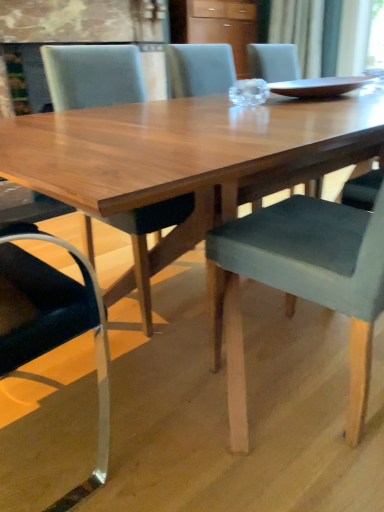
Describe the element at coordinates (319, 86) in the screenshot. Image resolution: width=384 pixels, height=512 pixels. I see `matte brown tray at center` at that location.

You are a GUI agent. You are given a task and a screenshot of the screen. Output one action in this format:
    pyautogui.click(x=<x>, y=<y>)
    Task: Click on the wooden cabinet at upper center
    This screenshot has height=512, width=384.
    Given the screenshot: What is the action you would take?
    pyautogui.click(x=224, y=26)

Considering the positions of objects wooden cabinet at upper center and matte gray chair at center, which is the 2th chair from right to left, in the image provided, who is behind, wooden cabinet at upper center or matte gray chair at center, which is the 2th chair from right to left,?

wooden cabinet at upper center is further away from the camera.

Is wooden cabinet at upper center inside the boundaries of matte gray chair at center, which is the 2th chair from right to left, or outside?

wooden cabinet at upper center is not enclosed by matte gray chair at center, which is the 2th chair from right to left.

Is wooden cabinet at upper center positioned far away from matte gray chair at center, which is the 2th chair from right to left?

Yes, wooden cabinet at upper center is far from matte gray chair at center, which is the 2th chair from right to left.

From the image's perspective, which is below, wooden cabinet at upper center or matte gray chair at center, which is the 2th chair from right to left?

matte gray chair at center, which is the 2th chair from right to left.

How different are the orientations of velvet grey chair at center, the first chair when ordered from right to left, and wooden cabinet at upper center in degrees?

The facing directions of velvet grey chair at center, the first chair when ordered from right to left, and wooden cabinet at upper center are 178 degrees apart.

Between velvet grey chair at center, positioned as the second chair in left-to-right order, and wooden cabinet at upper center, which one has smaller width?

wooden cabinet at upper center is thinner.

From the image's perspective, does velvet grey chair at center, the first chair when ordered from right to left, appear lower than wooden cabinet at upper center?

Yes.

Based on the photo, from a real-world perspective, between velvet grey chair at center, positioned as the second chair in left-to-right order, and wooden cabinet at upper center, who is vertically lower?

velvet grey chair at center, positioned as the second chair in left-to-right order.

Is matte gray chair at center, the first chair when ordered from left to right, positioned behind wooden cabinet at upper center?

That is False.

From a real-world perspective, which object rests below the other?

matte gray chair at center, which is the 2th chair from right to left, from a real-world perspective.

Is matte brown tray at center positioned with its back to wooden cabinet at upper center?

matte brown tray at center is not turned away from wooden cabinet at upper center.

Considering the sizes of objects matte brown tray at center and wooden cabinet at upper center in the image provided, who is shorter, matte brown tray at center or wooden cabinet at upper center?

matte brown tray at center.

Can you see matte brown tray at center touching wooden cabinet at upper center?

matte brown tray at center is not next to wooden cabinet at upper center, and they're not touching.

Measure the distance between matte brown tray at center and wooden cabinet at upper center.

matte brown tray at center is 1.80 meters from wooden cabinet at upper center.

Is wooden cabinet at upper center turned away from velvet grey chair at center, positioned as the second chair in left-to-right order?

No.

Do you think wooden cabinet at upper center is within velvet grey chair at center, the first chair when ordered from right to left, or outside of it?

wooden cabinet at upper center exists outside the volume of velvet grey chair at center, the first chair when ordered from right to left.

From the image's perspective, would you say wooden cabinet at upper center is positioned over velvet grey chair at center, the first chair when ordered from right to left?

Correct, wooden cabinet at upper center appears higher than velvet grey chair at center, the first chair when ordered from right to left, in the image.

Does wooden cabinet at upper center have a lesser width compared to velvet grey chair at center, positioned as the second chair in left-to-right order?

Indeed, wooden cabinet at upper center has a lesser width compared to velvet grey chair at center, positioned as the second chair in left-to-right order.

Could you tell me if velvet grey chair at center, the first chair when ordered from right to left, is turned towards matte brown tray at center?

No, velvet grey chair at center, the first chair when ordered from right to left, does not turn towards matte brown tray at center.

The width and height of the screenshot is (384, 512). Identify the location of tray lying on the right of velvet grey chair at center, positioned as the second chair in left-to-right order. (319, 86).

Is matte gray chair at center, which is the 2th chair from right to left, positioned with its back to matte brown tray at center?

No, matte gray chair at center, which is the 2th chair from right to left, is not facing the opposite direction of matte brown tray at center.

How many degrees apart are the facing directions of matte gray chair at center, the first chair when ordered from left to right, and matte brown tray at center?

179 degrees.

Is matte brown tray at center surrounded by matte gray chair at center, which is the 2th chair from right to left?

That's incorrect, matte brown tray at center is not inside matte gray chair at center, which is the 2th chair from right to left.

What are the coordinates of `cabinetry behind the matte gray chair at center, the first chair when ordered from left to right` in the screenshot? It's located at (224, 26).

I want to click on the 2nd chair in front of the wooden cabinet at upper center, so click(304, 283).

Consider the image. Based on their spatial positions, is matte gray chair at center, the first chair when ordered from left to right, or wooden cabinet at upper center further from velvet grey chair at center, the first chair when ordered from right to left?

wooden cabinet at upper center is further to velvet grey chair at center, the first chair when ordered from right to left.

Which object lies further to the anchor point velvet grey chair at center, positioned as the second chair in left-to-right order, matte gray chair at center, the first chair when ordered from left to right, or matte brown tray at center?

Among the two, matte gray chair at center, the first chair when ordered from left to right, is located further to velvet grey chair at center, positioned as the second chair in left-to-right order.

Based on their spatial positions, is matte gray chair at center, which is the 2th chair from right to left, or matte brown tray at center closer to wooden cabinet at upper center?

matte brown tray at center.

Considering their positions, is matte gray chair at center, the first chair when ordered from left to right, positioned further to matte brown tray at center than velvet grey chair at center, positioned as the second chair in left-to-right order?

matte gray chair at center, the first chair when ordered from left to right.

Estimate the real-world distances between objects in this image. Which object is further from matte brown tray at center, wooden cabinet at upper center or velvet grey chair at center, positioned as the second chair in left-to-right order?

wooden cabinet at upper center is positioned further to the anchor matte brown tray at center.

Which object lies further to the anchor point velvet grey chair at center, the first chair when ordered from right to left, wooden cabinet at upper center or matte gray chair at center, which is the 2th chair from right to left?

wooden cabinet at upper center lies further to velvet grey chair at center, the first chair when ordered from right to left, than the other object.

Looking at the image, which one is located further to matte brown tray at center, velvet grey chair at center, positioned as the second chair in left-to-right order, or wooden cabinet at upper center?

Among the two, wooden cabinet at upper center is located further to matte brown tray at center.

Considering their positions, is velvet grey chair at center, the first chair when ordered from right to left, positioned closer to wooden cabinet at upper center than matte brown tray at center?

matte brown tray at center lies closer to wooden cabinet at upper center than the other object.

You are a GUI agent. You are given a task and a screenshot of the screen. Output one action in this format:
    pyautogui.click(x=<x>, y=<y>)
    Task: Click on the chair located between velvet grey chair at center, positioned as the second chair in left-to-right order, and wooden cabinet at upper center in the depth direction
    Image resolution: width=384 pixels, height=512 pixels.
    Given the screenshot: What is the action you would take?
    pyautogui.click(x=92, y=75)

The width and height of the screenshot is (384, 512). I want to click on tray positioned between matte gray chair at center, the first chair when ordered from left to right, and wooden cabinet at upper center from near to far, so click(x=319, y=86).

This screenshot has width=384, height=512. I want to click on chair between matte gray chair at center, which is the 2th chair from right to left, and matte brown tray at center from left to right, so click(x=304, y=283).

Where is `tray between velvet grey chair at center, the first chair when ordered from right to left, and wooden cabinet at upper center, along the z-axis`? tray between velvet grey chair at center, the first chair when ordered from right to left, and wooden cabinet at upper center, along the z-axis is located at coordinates (319, 86).